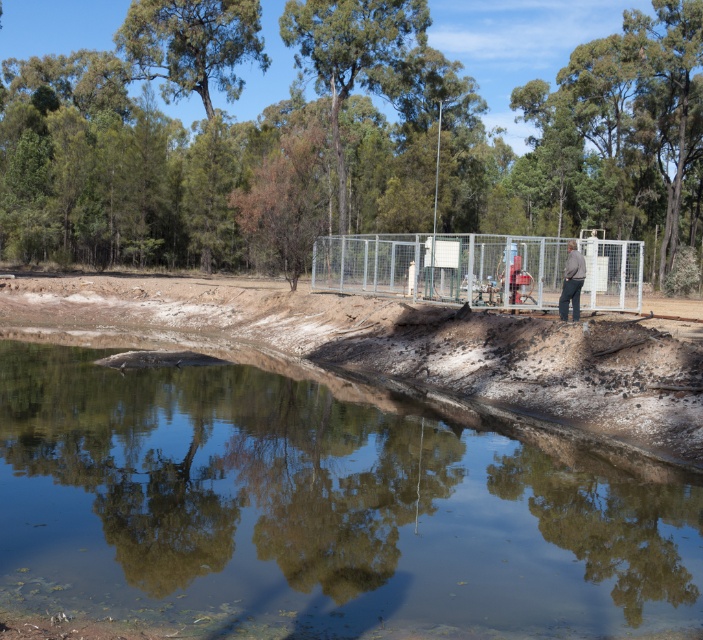
Question: Is clear water at center further to camera compared to metallic fence at center?

Choices:
 (A) no
 (B) yes

Answer: (A)

Question: Is clear water at center positioned behind gray fabric jacket at center?

Choices:
 (A) no
 (B) yes

Answer: (A)

Question: Which object is positioned farthest from the gray fabric jacket at center?

Choices:
 (A) clear water at center
 (B) metallic fence at center

Answer: (A)

Question: Estimate the real-world distances between objects in this image. Which object is farther from the clear water at center?

Choices:
 (A) metallic fence at center
 (B) gray fabric jacket at center

Answer: (A)

Question: Based on their relative distances, which object is farther from the gray fabric jacket at center?

Choices:
 (A) clear water at center
 (B) metallic fence at center

Answer: (A)

Question: Is metallic fence at center wider than gray fabric jacket at center?

Choices:
 (A) no
 (B) yes

Answer: (B)